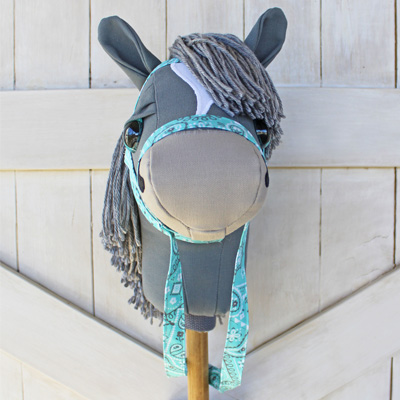
At what (x,y) coordinates should I click in order to perform the action: click on plush horse head. Please return your answer as a coordinate pair (x, y). Looking at the image, I should click on coord(183,95).